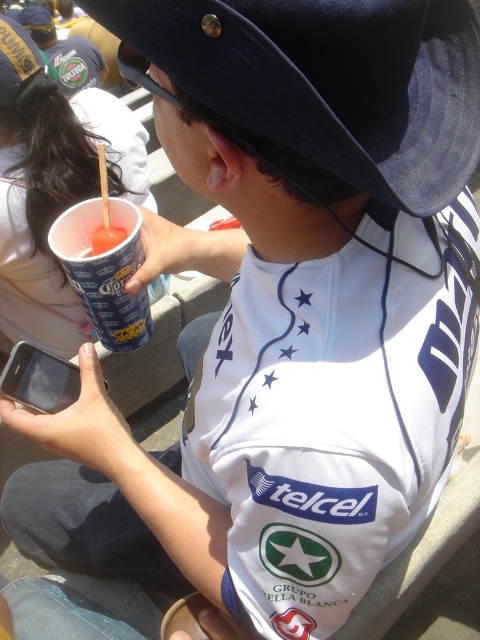
Question: Does black felt baseball hat at upper center appear over blue paper cup at lower left?

Choices:
 (A) yes
 (B) no

Answer: (A)

Question: Can you confirm if black felt baseball hat at upper center is smaller than blue paper cup at lower left?

Choices:
 (A) yes
 (B) no

Answer: (B)

Question: Which point appears farthest from the camera in this image?

Choices:
 (A) click(131, 333)
 (B) click(244, 102)

Answer: (A)

Question: Is black felt baseball hat at upper center below blue paper cup at lower left?

Choices:
 (A) yes
 (B) no

Answer: (B)

Question: Among these objects, which one is farthest from the camera?

Choices:
 (A) blue paper cup at lower left
 (B) black felt baseball hat at upper center

Answer: (A)

Question: Among these objects, which one is nearest to the camera?

Choices:
 (A) blue paper cup at lower left
 (B) black felt baseball hat at upper center

Answer: (B)